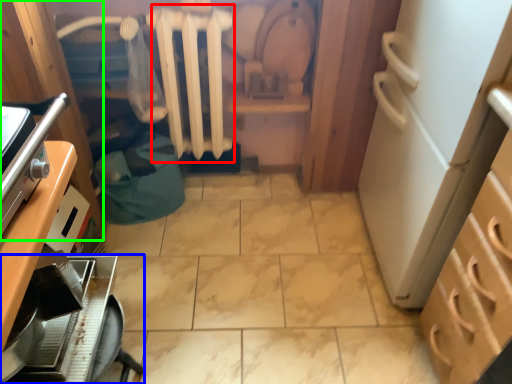
Question: Estimate the real-world distances between objects in this image. Which object is farther from radiator (highlighted by a red box), kitchen appliance (highlighted by a blue box) or cabinetry (highlighted by a green box)?

Choices:
 (A) kitchen appliance
 (B) cabinetry

Answer: (A)